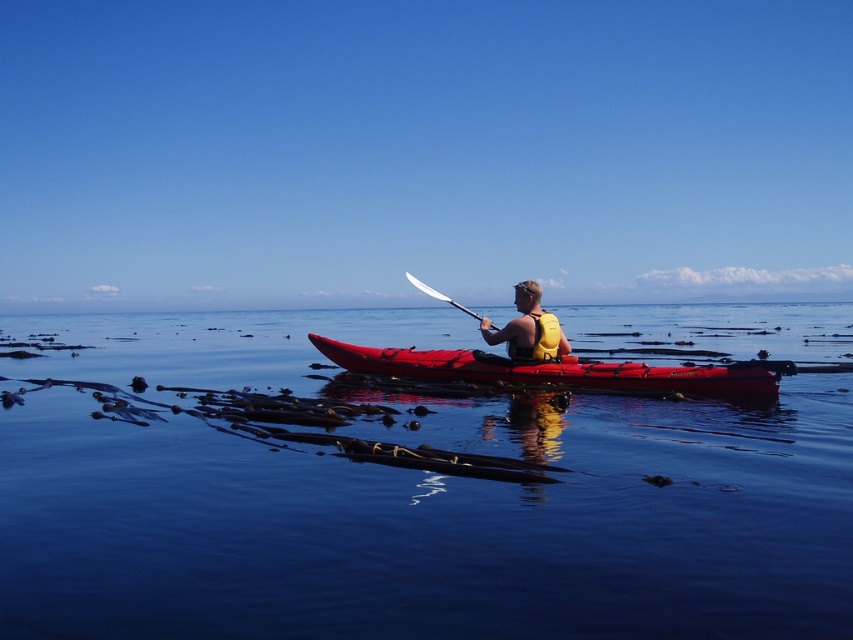
You are a photographer trying to capture the kayaker in the image. If you want to focus on the yellow life vest at center without the transparent water at center overlapping in the shot, should you adjust your camera angle to look above or below the current position?

Since the transparent water at center is in front of the yellow life vest at center, adjusting the camera angle to look above the current position would help avoid overlapping by focusing on the life vest without the water obstructing the view.

You are a photographer trying to capture the reflection of the white plastic paddle at center in the transparent water at center. Based on the scene, can you confirm if the paddle is positioned above the water where its reflection would be visible?

The transparent water at center is located below white plastic paddle at center, so the paddle is above the water, allowing its reflection to be visible in the water.